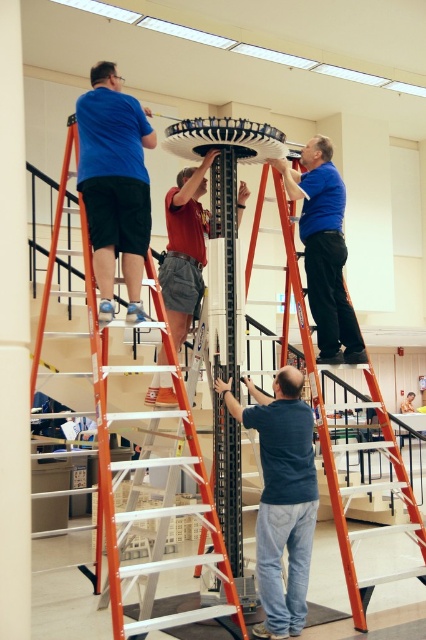
You are an observer in the workshop. You notice two workers wearing dark blue shirt at center and matte blue shirt at upper center. Which worker is narrower in width?

The dark blue shirt at center has a lesser width compared to matte blue shirt at upper center, so the worker in the dark blue shirt at center is narrower in width.